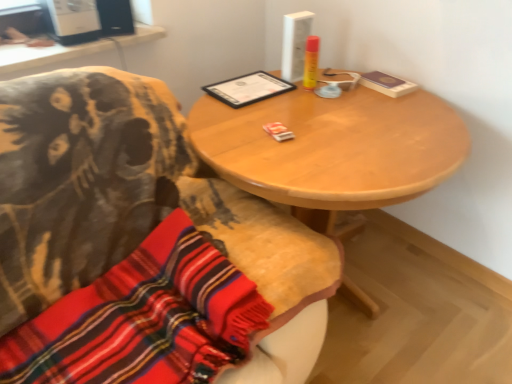
Question: Considering the relative positions of wooden chair at center and knitted wool scarf at lower left in the image provided, is wooden chair at center to the left of knitted wool scarf at lower left from the viewer's perspective?

Choices:
 (A) no
 (B) yes

Answer: (A)

Question: Can you confirm if wooden chair at center is positioned to the right of knitted wool scarf at lower left?

Choices:
 (A) yes
 (B) no

Answer: (A)

Question: Does wooden chair at center have a larger size compared to knitted wool scarf at lower left?

Choices:
 (A) yes
 (B) no

Answer: (A)

Question: Is wooden chair at center wider than knitted wool scarf at lower left?

Choices:
 (A) yes
 (B) no

Answer: (A)

Question: Are wooden chair at center and knitted wool scarf at lower left far apart?

Choices:
 (A) no
 (B) yes

Answer: (A)

Question: Could you tell me if wooden chair at center is facing knitted wool scarf at lower left?

Choices:
 (A) yes
 (B) no

Answer: (A)

Question: From a real-world perspective, is white plastic computer desk at upper left below wooden chair at center?

Choices:
 (A) yes
 (B) no

Answer: (B)

Question: Are white plastic computer desk at upper left and wooden chair at center making contact?

Choices:
 (A) yes
 (B) no

Answer: (B)

Question: Is white plastic computer desk at upper left far away from wooden chair at center?

Choices:
 (A) yes
 (B) no

Answer: (B)

Question: Can you confirm if white plastic computer desk at upper left is thinner than wooden chair at center?

Choices:
 (A) no
 (B) yes

Answer: (B)

Question: Does white plastic computer desk at upper left have a lesser height compared to wooden chair at center?

Choices:
 (A) yes
 (B) no

Answer: (A)

Question: Is white plastic computer desk at upper left oriented away from wooden chair at center?

Choices:
 (A) no
 (B) yes

Answer: (A)

Question: Considering the relative sizes of wooden table at center and knitted wool scarf at lower left in the image provided, is wooden table at center shorter than knitted wool scarf at lower left?

Choices:
 (A) yes
 (B) no

Answer: (B)